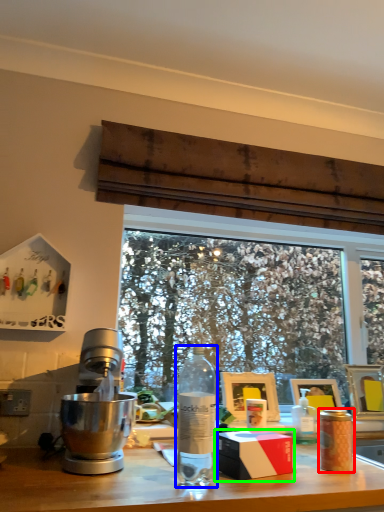
Question: Which is farther away from coffee cup (highlighted by a red box)? bottle (highlighted by a blue box) or box (highlighted by a green box)?

Choices:
 (A) bottle
 (B) box

Answer: (A)